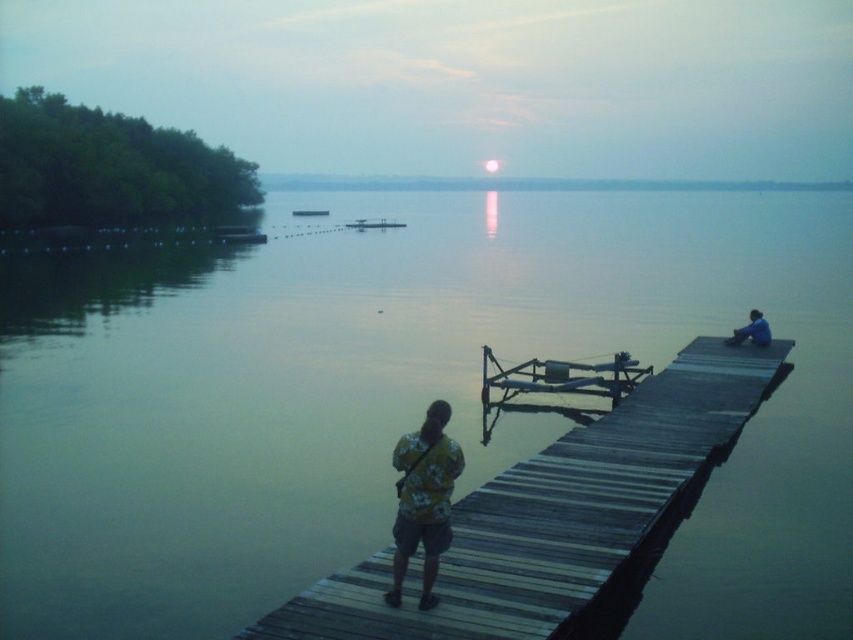
You are planning to place a small bench on the wooden dock at center. Considering the blue fabric shirt at right is currently occupying space on the dock, can the bench be placed between them without overlapping?

The wooden dock at center might be wider than blue fabric shirt at right, so there might be enough space to place the bench between them without overlapping.

Based on the scene description, where is the smooth water at center located in terms of its 2D coordinates?

The smooth water at center is located at the 2D coordinates of point (402, 401).

You are a photographer trying to capture both the yellow floral shirt at center and the blue fabric shirt at right in a single shot. Since you want to include both subjects, which one should you focus on first to ensure both are in sharp focus?

You should focus on the yellow floral shirt at center first because it is closer to the camera than the blue fabric shirt at right. By focusing on the closer subject, the farther one will also be in focus due to the depth of field.